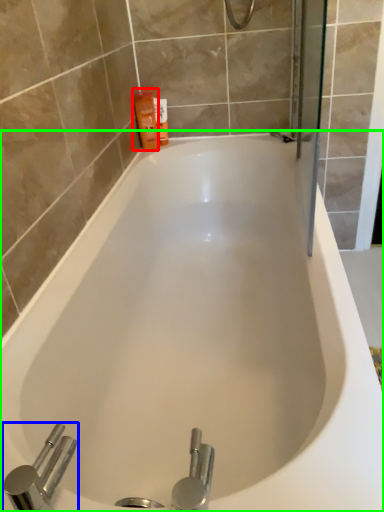
Question: Which is nearer to the toiletry (highlighted by a red box)? tap (highlighted by a blue box) or bathtub (highlighted by a green box).

Choices:
 (A) tap
 (B) bathtub

Answer: (B)